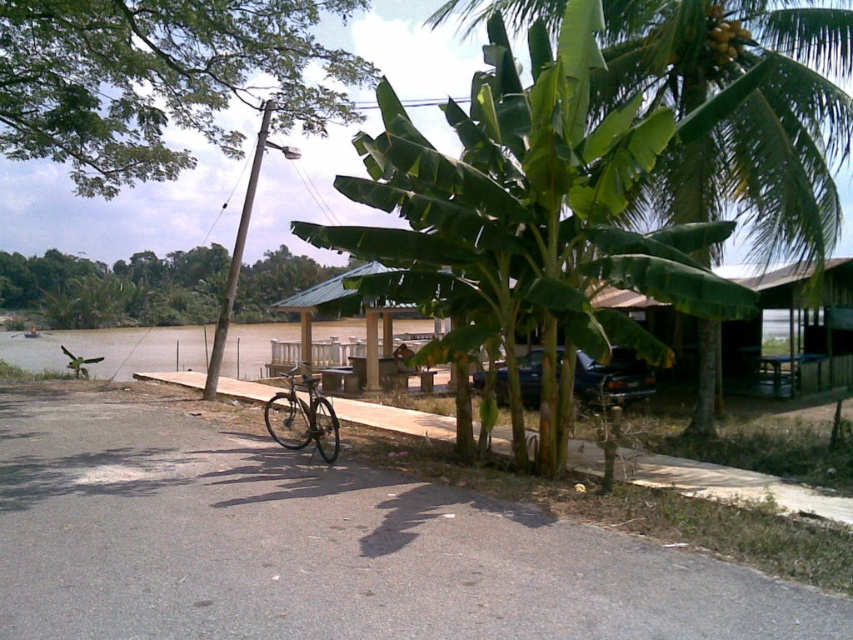
Question: Which of the following is the closest to the observer?

Choices:
 (A) shiny metallic bicycle at center
 (B) yellow-green textured bananas at upper right

Answer: (A)

Question: Does green leafy tree at upper left have a larger size compared to green leafy tree at center?

Choices:
 (A) yes
 (B) no

Answer: (A)

Question: Which object is the farthest from the shiny metallic bicycle at center?

Choices:
 (A) yellow-green textured bananas at upper right
 (B) green leafy tree at center
 (C) green leafy tree at upper left
 (D) green leafy banana tree at center

Answer: (B)

Question: Does green leafy banana tree at center appear on the right side of green leafy tree at center?

Choices:
 (A) no
 (B) yes

Answer: (B)

Question: From the image, what is the correct spatial relationship of green leafy tree at upper left in relation to yellow-green textured bananas at upper right?

Choices:
 (A) below
 (B) above

Answer: (B)

Question: Which object is the farthest from the shiny metallic bicycle at center?

Choices:
 (A) green leafy banana tree at center
 (B) green leafy tree at center
 (C) green leafy tree at upper left

Answer: (B)